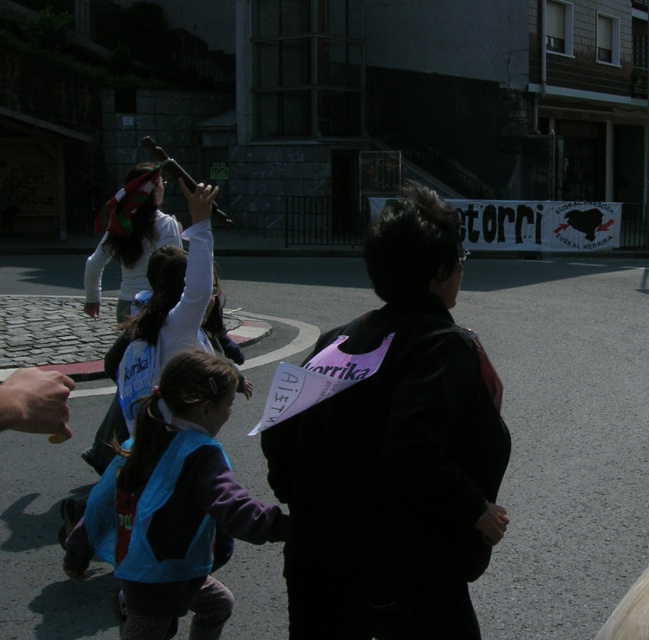
You are standing at the camera position in the street scene. There are two points marked in the image. Which point, point (x=258, y=525) or point (x=110, y=244), is closer to you?

Point (x=258, y=525) is closer to the camera than point (x=110, y=244).

Consider the image. You are standing at the camera position and want to walk to both points in the image. Which point should you reach first, point (356, 611) or point (108, 428)?

Point (356, 611) is closer to the camera than point (108, 428), so you will reach point (356, 611) first.